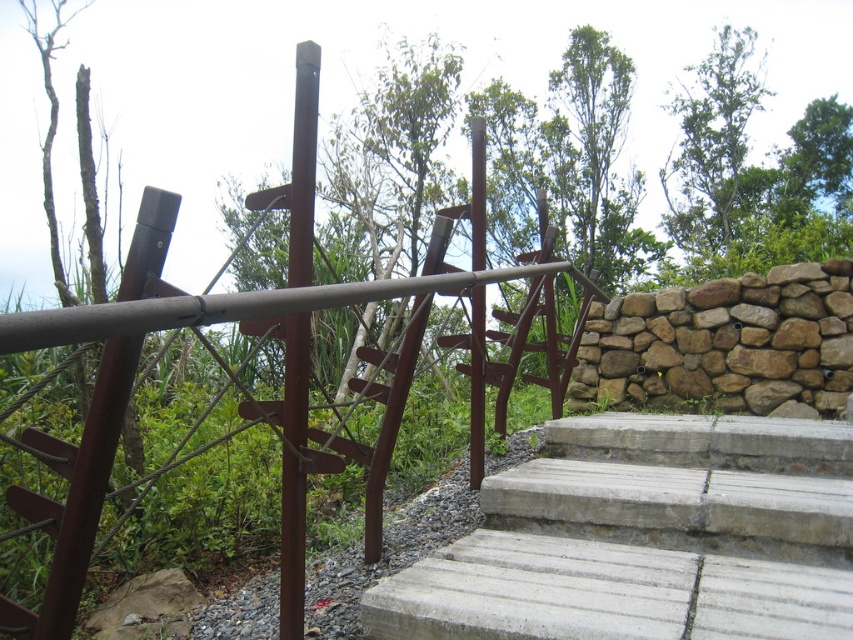
Question: Is concrete/steps at lower right to the right of brown matte pole at center from the viewer's perspective?

Choices:
 (A) no
 (B) yes

Answer: (B)

Question: Which point is farther to the camera?

Choices:
 (A) concrete/steps at lower right
 (B) brown matte pole at center
 (C) brown rough stone wall at right
 (D) brown wooden pole at center

Answer: (C)

Question: Is brown rough stone wall at right above brown matte pole at center?

Choices:
 (A) no
 (B) yes

Answer: (B)

Question: Is brown rough stone wall at right to the right of brown matte pole at center from the viewer's perspective?

Choices:
 (A) yes
 (B) no

Answer: (A)

Question: Which point is closer to the camera?

Choices:
 (A) brown wooden pole at center
 (B) concrete/steps at lower right

Answer: (B)

Question: Among these points, which one is nearest to the camera?

Choices:
 (A) click(x=477, y=397)
 (B) click(x=624, y=365)
 (C) click(x=305, y=224)

Answer: (C)